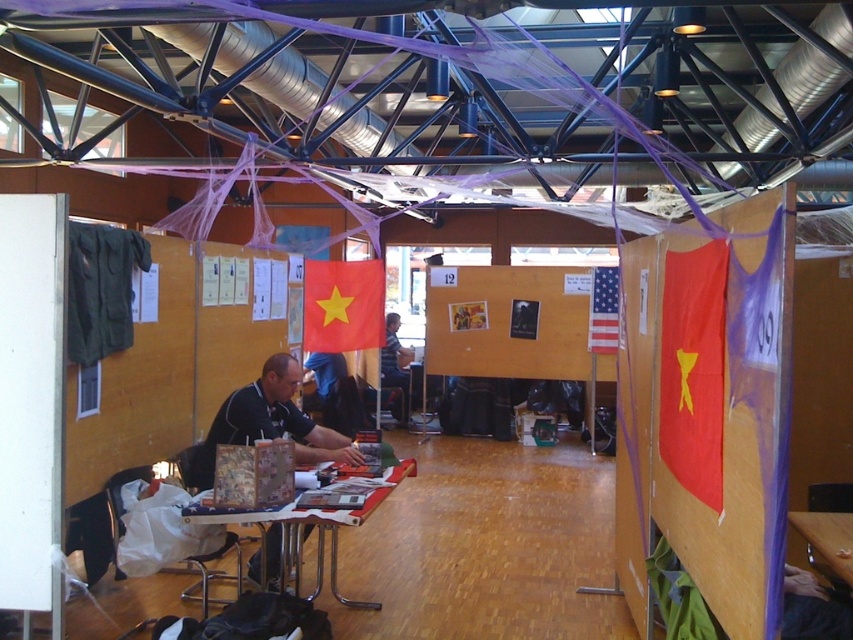
Can you confirm if matte red flag at center is smaller than american flag at center?

Incorrect, matte red flag at center is not smaller in size than american flag at center.

Is matte red flag at center to the left of american flag at center from the viewer's perspective?

Yes, matte red flag at center is to the left of american flag at center.

Does point (651, 467) come farther from viewer compared to point (614, 352)?

No.

Locate an element on the screen. matte red flag at center is located at coordinates (718, 419).

Can you confirm if red matte flag at right is positioned to the left of black matte shirt at center?

Incorrect, red matte flag at right is not on the left side of black matte shirt at center.

From the picture: Does red matte flag at right have a smaller size compared to black matte shirt at center?

Correct, red matte flag at right occupies less space than black matte shirt at center.

Image resolution: width=853 pixels, height=640 pixels. What are the coordinates of `red matte flag at right` in the screenshot? It's located at pyautogui.click(x=693, y=369).

Is point (637, 608) farther from viewer compared to point (274, 544)?

No, (637, 608) is closer to viewer.

What do you see at coordinates (718, 419) in the screenshot? I see `matte red flag at center` at bounding box center [718, 419].

Identify the location of matte red flag at center. coord(718,419).